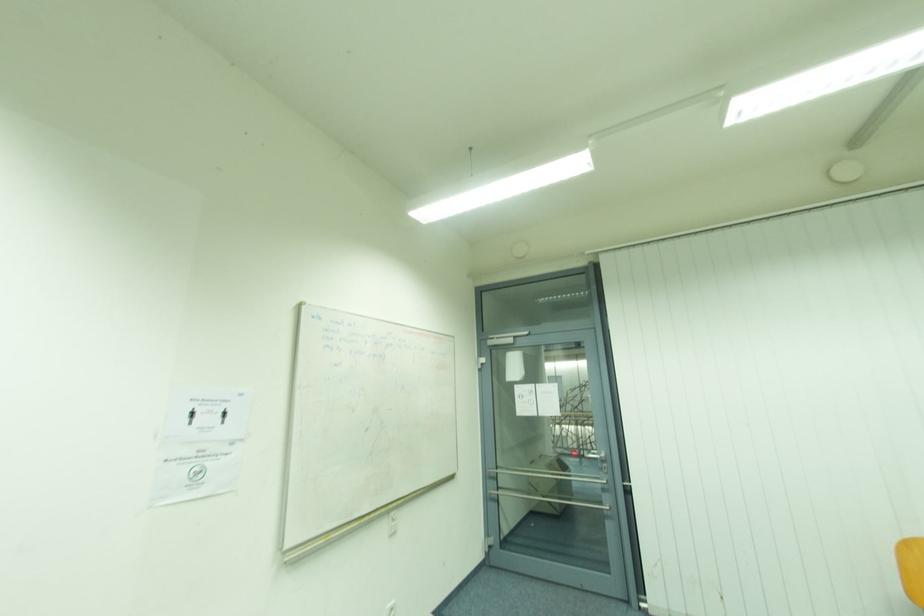
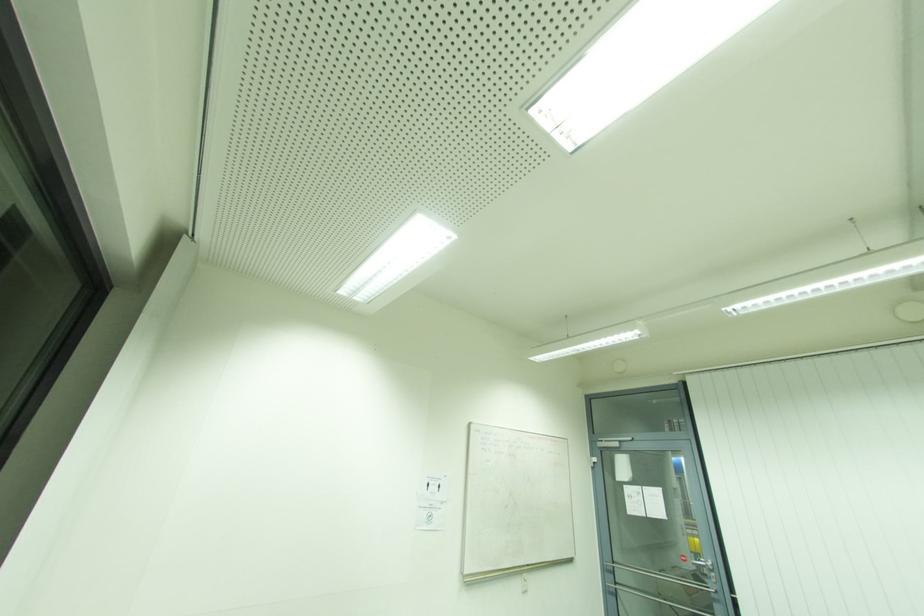
Question: The images are taken continuously from a first-person perspective. In which direction are you moving?

Choices:
 (A) Left
 (B) Right
 (C) Forward
 (D) Backward

Answer: (D)